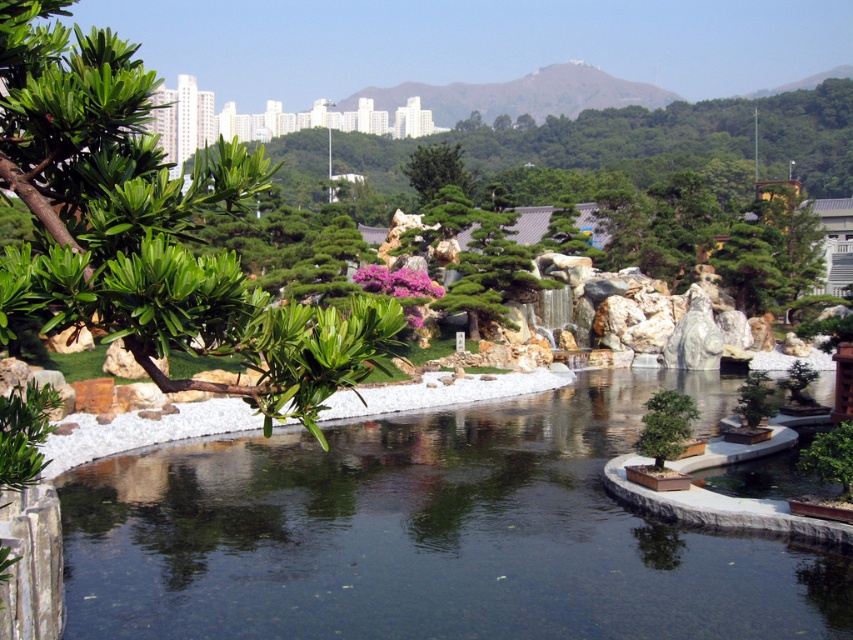
You are a gardener planning to prune the green leafy branch at left and the green textured tree at center. Which of these two plants is closer to the left edge of the garden?

The green leafy branch at left is closer to the left edge of the garden because it is positioned to the left of the green textured tree at center.

You are standing in the garden and want to take a photo of the point at coordinates point (572, 596). If your camera has a maximum focus range of 10 meters, will you be able to capture the point clearly?

The point (572, 596) is 8.87 meters from the camera, which is within the maximum focus range of 10 meters. Therefore, you can capture the point clearly.

Based on the photo, you are a gardener planning to place a small decorative stone in the garden. You want to ensure it doesn not obstruct the view of the clear water at center from the green leafy branch at left. Which object should you place the stone closer to?

The clear water at center is smaller than the green leafy branch at left, so placing the stone closer to the green leafy branch at left would be less likely to obstruct the view of the smaller clear water at center.